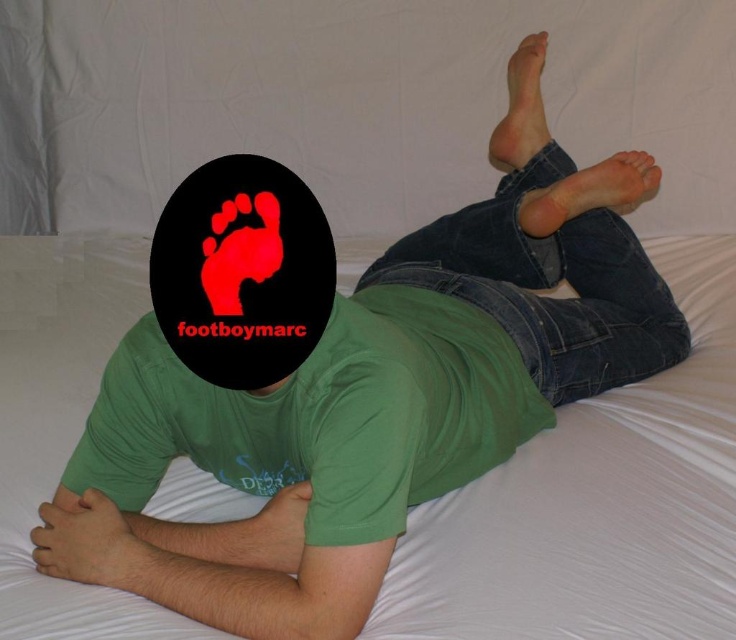
Based on the scene description, where is the smooth skin hand at lower left located in the image?

The smooth skin hand at lower left is located at point (85, 541) in the image.